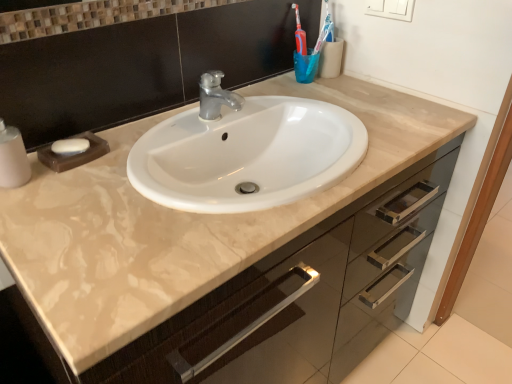
Question: From the image's perspective, is translucent blue cup at upper right on top of white matte soap at left?

Choices:
 (A) no
 (B) yes

Answer: (B)

Question: From a real-world perspective, is translucent blue cup at upper right positioned over white matte soap at left based on gravity?

Choices:
 (A) no
 (B) yes

Answer: (B)

Question: Is translucent blue cup at upper right oriented towards white matte soap at left?

Choices:
 (A) no
 (B) yes

Answer: (A)

Question: Does translucent blue cup at upper right have a smaller size compared to white matte soap at left?

Choices:
 (A) no
 (B) yes

Answer: (A)

Question: Would you say translucent blue cup at upper right is outside white matte soap at left?

Choices:
 (A) no
 (B) yes

Answer: (B)

Question: Is the surface of translucent blue cup at upper right in direct contact with white matte soap at left?

Choices:
 (A) yes
 (B) no

Answer: (B)

Question: Considering the relative positions of white matte soap at left and translucent blue cup at upper right in the image provided, is white matte soap at left in front of translucent blue cup at upper right?

Choices:
 (A) yes
 (B) no

Answer: (A)

Question: Is white matte soap at left wider than translucent blue cup at upper right?

Choices:
 (A) yes
 (B) no

Answer: (A)

Question: Is white matte soap at left looking in the opposite direction of translucent blue cup at upper right?

Choices:
 (A) no
 (B) yes

Answer: (A)

Question: From a real-world perspective, is white matte soap at left under translucent blue cup at upper right?

Choices:
 (A) no
 (B) yes

Answer: (B)

Question: From the image's perspective, does white matte soap at left appear lower than translucent blue cup at upper right?

Choices:
 (A) yes
 (B) no

Answer: (A)

Question: Could you tell me if white matte soap at left is turned towards translucent blue cup at upper right?

Choices:
 (A) yes
 (B) no

Answer: (B)

Question: Considering the positions of translucent blue cup at upper right and white matte soap at left in the image, is translucent blue cup at upper right wider or thinner than white matte soap at left?

Choices:
 (A) thin
 (B) wide

Answer: (A)